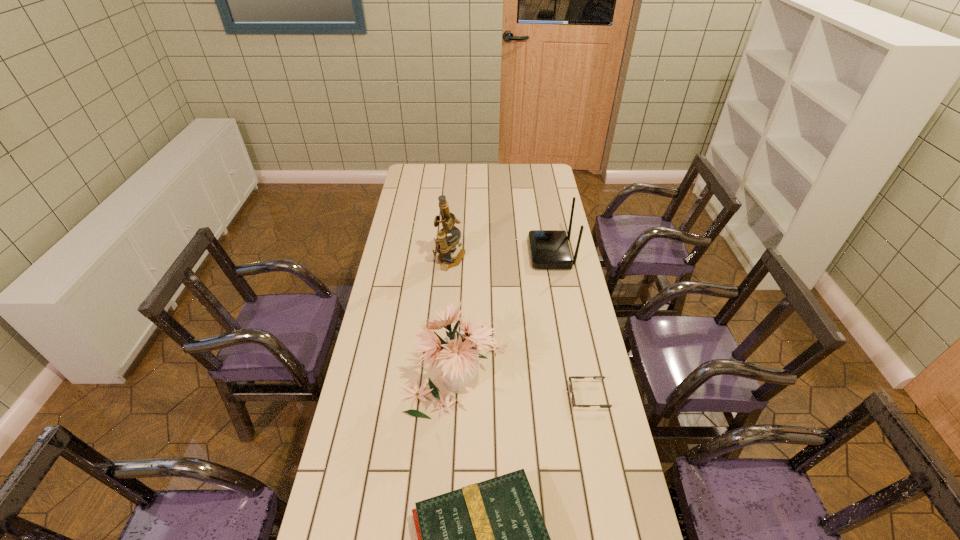
Where is `vacant space located on the temples of the shortest object`? Image resolution: width=960 pixels, height=540 pixels. vacant space located on the temples of the shortest object is located at coordinates (493, 396).

The width and height of the screenshot is (960, 540). I want to click on free space located on the temples of the shortest object, so click(x=471, y=396).

Locate an element on the screen. Image resolution: width=960 pixels, height=540 pixels. object positioned at the left edge is located at coordinates (459, 352).

Identify the location of router present at the right edge. The height and width of the screenshot is (540, 960). (549, 249).

At what (x,y) coordinates should I click in order to perform the action: click on sunglasses at the right edge. Please return your answer as a coordinate pair (x, y). The height and width of the screenshot is (540, 960). Looking at the image, I should click on (574, 377).

Identify the location of free spot at the far edge of the desktop. Image resolution: width=960 pixels, height=540 pixels. (492, 187).

In the image, there is a desktop. In order to click on free region at the left edge in this screenshot , I will do `click(377, 393)`.

Find the location of a particular element. vacant space at the right edge is located at coordinates pos(607,413).

Locate an element on the screen. The image size is (960, 540). vacant area at the far left corner is located at coordinates (414, 182).

Where is `vacant position at the far right corner of the desktop`? This screenshot has height=540, width=960. vacant position at the far right corner of the desktop is located at coordinates tap(533, 172).